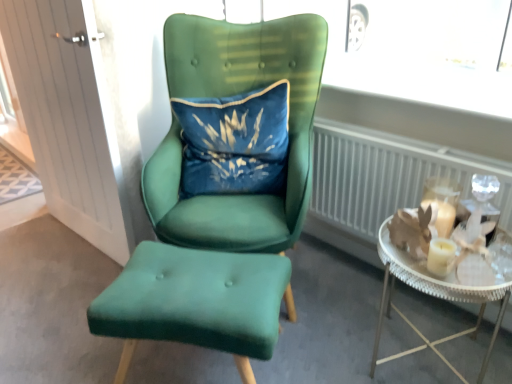
Identify the location of vacant space to the left of metallic silver tray at right. (326, 334).